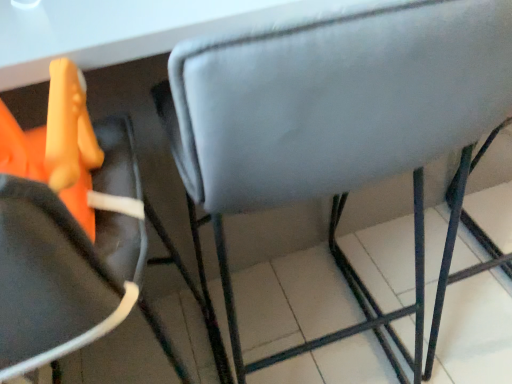
Question: Should I look upward or downward to see velvet-like gray chair at center, which is the 1th chair from right to left?

Choices:
 (A) down
 (B) up

Answer: (A)

Question: From a real-world perspective, is velvet-like gray chair at center, the 2th chair viewed from the left, positioned over matte gray cushion at center, acting as the 2th chair starting from the right, based on gravity?

Choices:
 (A) yes
 (B) no

Answer: (A)

Question: Considering the relative sizes of velvet-like gray chair at center, the 2th chair viewed from the left, and matte gray cushion at center, acting as the 2th chair starting from the right, in the image provided, is velvet-like gray chair at center, the 2th chair viewed from the left, wider than matte gray cushion at center, acting as the 2th chair starting from the right,?

Choices:
 (A) no
 (B) yes

Answer: (A)

Question: Can you confirm if velvet-like gray chair at center, the 2th chair viewed from the left, is taller than matte gray cushion at center, acting as the 2th chair starting from the right?

Choices:
 (A) no
 (B) yes

Answer: (A)

Question: Is velvet-like gray chair at center, the 2th chair viewed from the left, looking in the opposite direction of matte gray cushion at center, acting as the 2th chair starting from the right?

Choices:
 (A) no
 (B) yes

Answer: (A)

Question: Is velvet-like gray chair at center, the 2th chair viewed from the left, further to the viewer compared to matte gray cushion at center, acting as the 2th chair starting from the right?

Choices:
 (A) no
 (B) yes

Answer: (B)

Question: Is velvet-like gray chair at center, which is the 1th chair from right to left, thinner than matte gray cushion at center, acting as the 2th chair starting from the right?

Choices:
 (A) no
 (B) yes

Answer: (B)

Question: Is matte gray cushion at center, acting as the 2th chair starting from the right, closer to the viewer compared to velvet-like gray chair at center, which is the 1th chair from right to left?

Choices:
 (A) no
 (B) yes

Answer: (B)

Question: From a real-world perspective, is matte gray cushion at center, acting as the 2th chair starting from the right, physically below velvet-like gray chair at center, the 2th chair viewed from the left?

Choices:
 (A) no
 (B) yes

Answer: (B)

Question: Considering the relative sizes of matte gray cushion at center, positioned as the 1th chair in left-to-right order, and velvet-like gray chair at center, which is the 1th chair from right to left, in the image provided, is matte gray cushion at center, positioned as the 1th chair in left-to-right order, shorter than velvet-like gray chair at center, which is the 1th chair from right to left,?

Choices:
 (A) yes
 (B) no

Answer: (B)

Question: Does matte gray cushion at center, acting as the 2th chair starting from the right, turn towards velvet-like gray chair at center, which is the 1th chair from right to left?

Choices:
 (A) yes
 (B) no

Answer: (B)

Question: From the image's perspective, would you say matte gray cushion at center, acting as the 2th chair starting from the right, is shown under velvet-like gray chair at center, the 2th chair viewed from the left?

Choices:
 (A) no
 (B) yes

Answer: (B)

Question: Is the surface of matte gray cushion at center, acting as the 2th chair starting from the right, in direct contact with velvet-like gray chair at center, which is the 1th chair from right to left?

Choices:
 (A) no
 (B) yes

Answer: (A)

Question: From a real-world perspective, relative to velvet-like gray chair at center, the 2th chair viewed from the left, is matte gray cushion at center, acting as the 2th chair starting from the right, vertically above or below?

Choices:
 (A) below
 (B) above

Answer: (A)